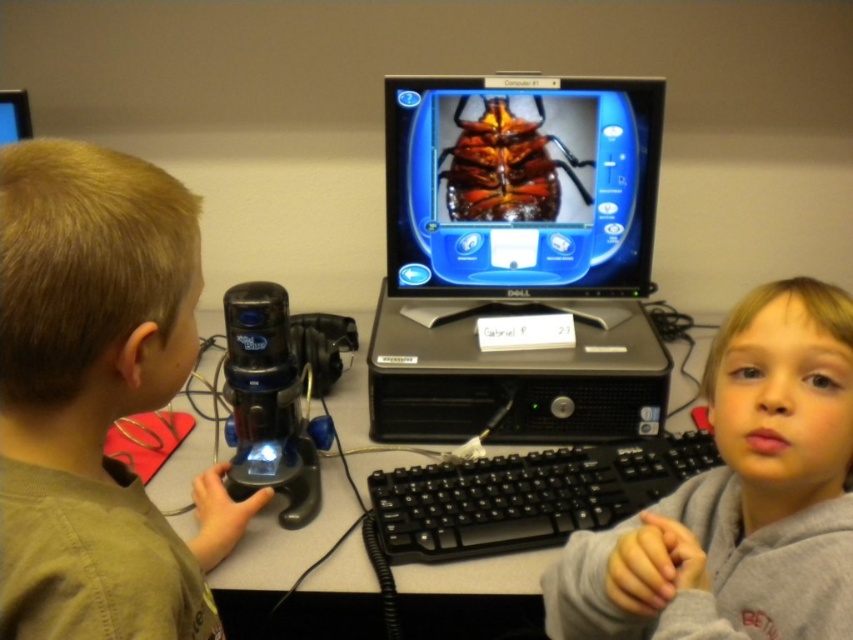
Question: Considering the real-world distances, which object is farthest from the black plastic desktop computer at center?

Choices:
 (A) gray fleece sweatshirt at center right
 (B) light brown hair at left

Answer: (B)

Question: Which of these objects is positioned closest to the black plastic desktop computer at center?

Choices:
 (A) matte black monitor at upper center
 (B) black plastic computer desk at center

Answer: (B)

Question: Can you confirm if black plastic desktop computer at center is positioned to the right of black plastic computer desk at center?

Choices:
 (A) no
 (B) yes

Answer: (B)

Question: Can you confirm if gray fleece sweatshirt at center right is bigger than black plastic keyboard at center?

Choices:
 (A) yes
 (B) no

Answer: (A)

Question: Is light brown hair at left positioned in front of black plastic keyboard at center?

Choices:
 (A) no
 (B) yes

Answer: (B)

Question: Which of these objects is positioned farthest from the black plastic desktop computer at center?

Choices:
 (A) gray fleece sweatshirt at center right
 (B) black plastic keyboard at center

Answer: (A)